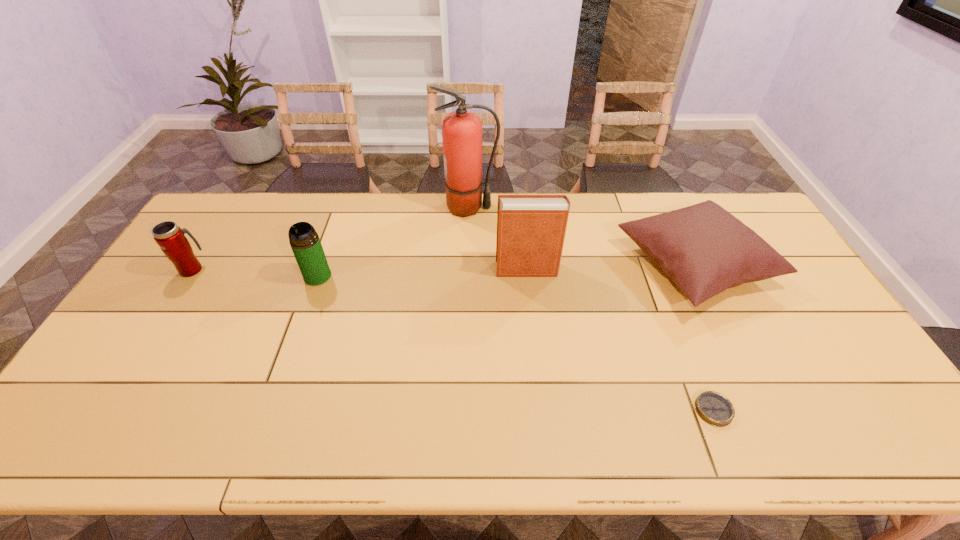
Image resolution: width=960 pixels, height=540 pixels. What are the coordinates of `free spot that satisfies the following two spatial constraints: 1. on the open cover of the hardback book; 2. on the right side of the shortest object` in the screenshot? It's located at [x=542, y=410].

Locate an element on the screen. free space in the image that satisfies the following two spatial constraints: 1. on the nozzle of the compass; 2. on the left side of the fire extinguisher is located at coordinates (462, 410).

Locate an element on the screen. vacant area that satisfies the following two spatial constraints: 1. on the open cover of the hardback book; 2. on the back side of the compass is located at coordinates (542, 410).

The image size is (960, 540). I want to click on free space in the image that satisfies the following two spatial constraints: 1. on the nozzle of the shortest object; 2. on the left side of the tallest object, so click(462, 410).

This screenshot has width=960, height=540. Identify the location of free space that satisfies the following two spatial constraints: 1. on the side with the handle of the shorter thermos bottle; 2. on the left side of the cushion. (195, 265).